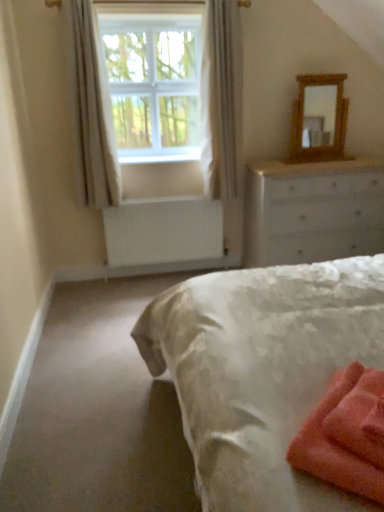
Question: Does soft coral towel at lower right appear on the left side of white sheer curtain at upper left, arranged as the 1th curtain when viewed from the left?

Choices:
 (A) no
 (B) yes

Answer: (A)

Question: Would you say white sheer curtain at upper left, arranged as the 1th curtain when viewed from the left, is part of soft coral towel at lower right's contents?

Choices:
 (A) yes
 (B) no

Answer: (B)

Question: Is soft coral towel at lower right looking in the opposite direction of white sheer curtain at upper left, marked as the second curtain in a right-to-left arrangement?

Choices:
 (A) yes
 (B) no

Answer: (B)

Question: Can you confirm if soft coral towel at lower right is taller than white sheer curtain at upper left, marked as the second curtain in a right-to-left arrangement?

Choices:
 (A) yes
 (B) no

Answer: (B)

Question: Would you consider soft coral towel at lower right to be distant from white sheer curtain at upper left, arranged as the 1th curtain when viewed from the left?

Choices:
 (A) no
 (B) yes

Answer: (B)

Question: In terms of width, does white painted wood at lower center look wider or thinner when compared to white plastic window screen at upper center?

Choices:
 (A) thin
 (B) wide

Answer: (A)

Question: Does point (198, 156) appear closer or farther from the camera than point (185, 69)?

Choices:
 (A) farther
 (B) closer

Answer: (A)

Question: Relative to white plastic window screen at upper center, is white painted wood at lower center in front or behind?

Choices:
 (A) behind
 (B) front

Answer: (A)

Question: Based on their sizes in the image, would you say white painted wood at lower center is bigger or smaller than white plastic window screen at upper center?

Choices:
 (A) small
 (B) big

Answer: (A)

Question: Is white painted wood chest of drawers at upper right wider or thinner than soft coral towel at lower right?

Choices:
 (A) thin
 (B) wide

Answer: (B)

Question: From a real-world perspective, is white painted wood chest of drawers at upper right physically located above or below soft coral towel at lower right?

Choices:
 (A) above
 (B) below

Answer: (B)

Question: From the image's perspective, is white painted wood chest of drawers at upper right positioned above or below soft coral towel at lower right?

Choices:
 (A) above
 (B) below

Answer: (A)

Question: Considering the positions of white painted wood chest of drawers at upper right and soft coral towel at lower right in the image, is white painted wood chest of drawers at upper right bigger or smaller than soft coral towel at lower right?

Choices:
 (A) big
 (B) small

Answer: (A)

Question: Considering the positions of white painted wood at lower center and wooden mirror at upper right in the image, is white painted wood at lower center taller or shorter than wooden mirror at upper right?

Choices:
 (A) tall
 (B) short

Answer: (B)

Question: Visually, is white painted wood at lower center positioned to the left or to the right of wooden mirror at upper right?

Choices:
 (A) left
 (B) right

Answer: (A)